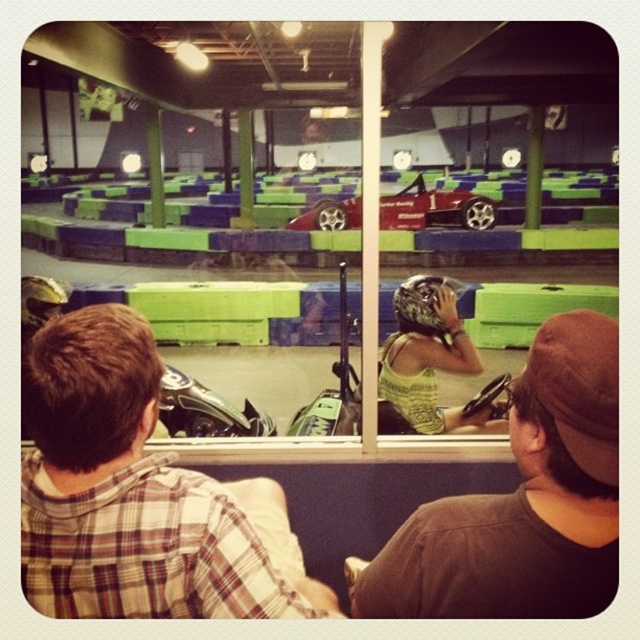
You are a spectator at the go kart track and you want to take a photo of both the plaid shirt at center and the shiny red car at center. Which object should you frame first in your camera viewfinder to ensure both are in the shot?

The plaid shirt at center is positioned on the left side of shiny red car at center, so you should frame the plaid shirt at center first to ensure both are in the shot.